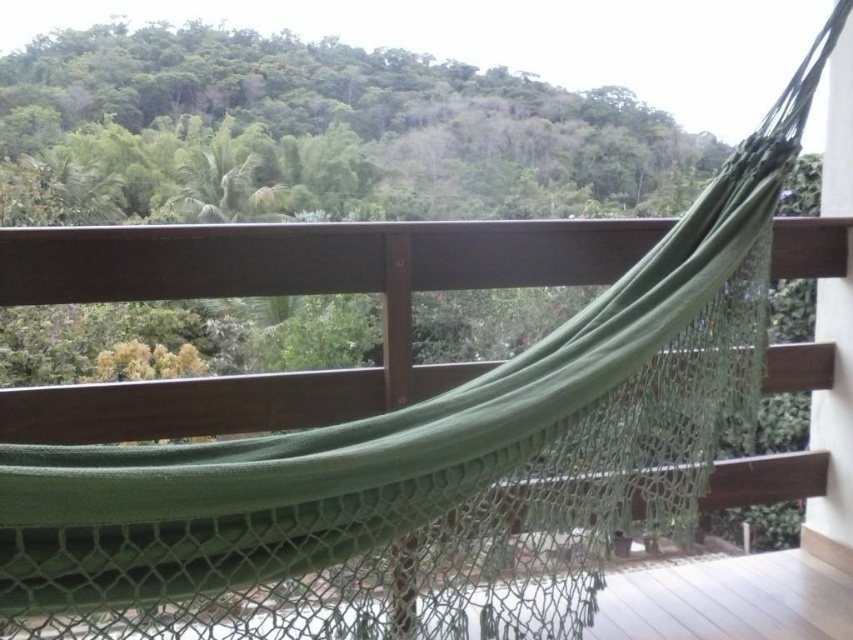
Question: Which object is the farthest from the green leafy tree at upper center?

Choices:
 (A) green fabric hammock at center
 (B) green mesh hammock at center

Answer: (A)

Question: Is green leafy tree at upper center to the left of green mesh hammock at center from the viewer's perspective?

Choices:
 (A) yes
 (B) no

Answer: (A)

Question: Considering the real-world distances, which object is farthest from the green mesh hammock at center?

Choices:
 (A) green leafy tree at upper center
 (B) green fabric hammock at center

Answer: (A)

Question: Is green fabric hammock at center positioned in front of green mesh hammock at center?

Choices:
 (A) no
 (B) yes

Answer: (B)

Question: Which object is farther from the camera taking this photo?

Choices:
 (A) green leafy tree at upper center
 (B) green mesh hammock at center
 (C) green fabric hammock at center

Answer: (A)

Question: Does green fabric hammock at center have a greater width compared to green mesh hammock at center?

Choices:
 (A) no
 (B) yes

Answer: (B)